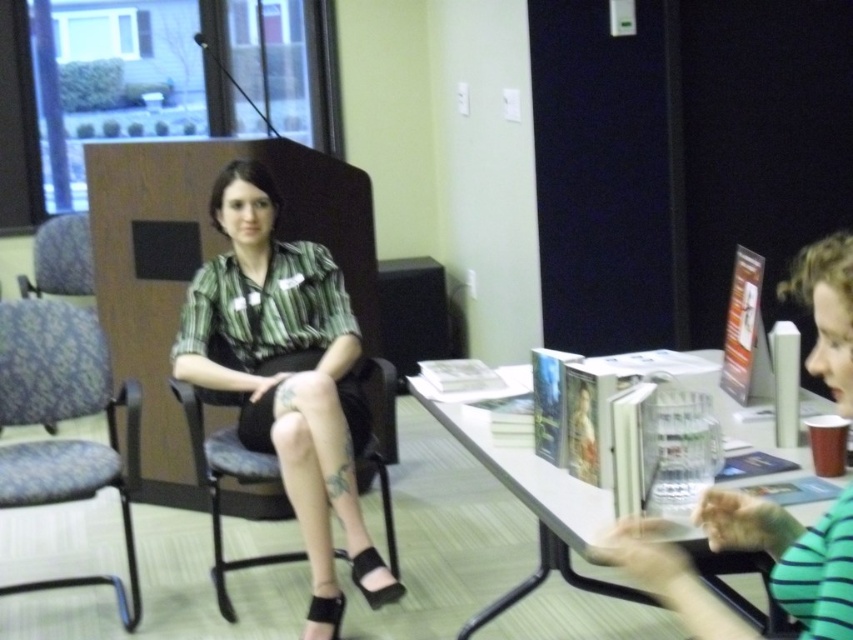
Question: Which of the following is the closest to the observer?

Choices:
 (A) velvet-like fabric armchair at left
 (B) white glossy table at center
 (C) matte green shirt at center
 (D) blue fabric swivel chair at left

Answer: (B)

Question: Does green striped shirt at right come in front of velvet-like fabric armchair at left?

Choices:
 (A) no
 (B) yes

Answer: (B)

Question: Which object is positioned closest to the blue fabric swivel chair at left?

Choices:
 (A) white glossy table at center
 (B) green striped shirt at right
 (C) velvet-like fabric armchair at left
 (D) matte green shirt at center

Answer: (D)

Question: From the image, what is the correct spatial relationship of green striped shirt at right in relation to velvet-like fabric armchair at left?

Choices:
 (A) left
 (B) right

Answer: (B)

Question: Estimate the real-world distances between objects in this image. Which object is closer to the blue fabric swivel chair at left?

Choices:
 (A) velvet-like fabric armchair at left
 (B) green striped shirt at right
 (C) white glossy table at center
 (D) matte green shirt at center

Answer: (D)

Question: Where is matte green shirt at center located in relation to white glossy table at center in the image?

Choices:
 (A) right
 (B) left

Answer: (B)